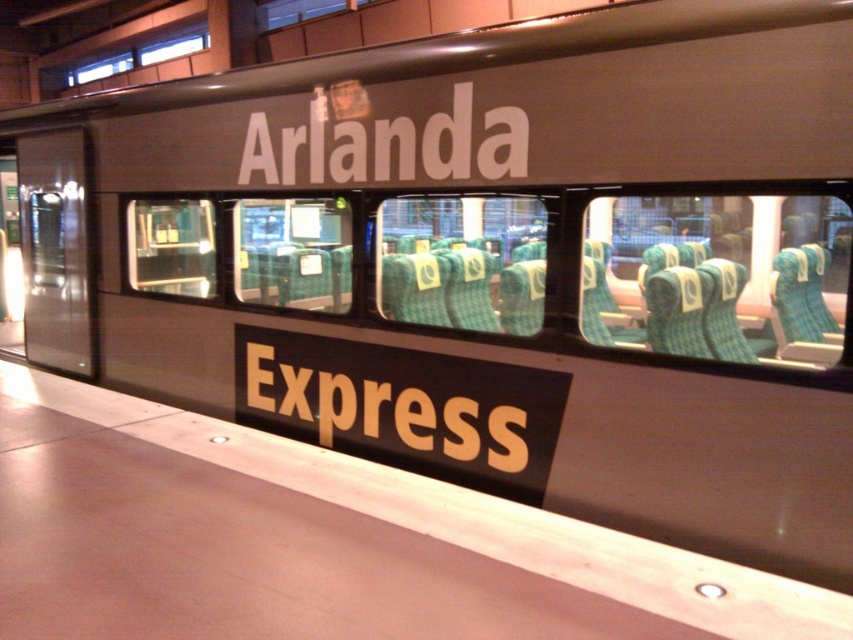
Question: Which point is closer to the camera taking this photo?

Choices:
 (A) (347, 392)
 (B) (378, 172)

Answer: (B)

Question: Which of the following is the closest to the observer?

Choices:
 (A) white matte text at center
 (B) yellow matte express at lower center

Answer: (A)

Question: Is yellow matte express at lower center thinner than white matte text at center?

Choices:
 (A) yes
 (B) no

Answer: (B)

Question: Which point is closer to the camera taking this photo?

Choices:
 (A) (299, 419)
 (B) (502, 154)

Answer: (B)

Question: Does yellow matte express at lower center lie in front of white matte text at center?

Choices:
 (A) no
 (B) yes

Answer: (A)

Question: Does yellow matte express at lower center have a lesser width compared to white matte text at center?

Choices:
 (A) yes
 (B) no

Answer: (B)